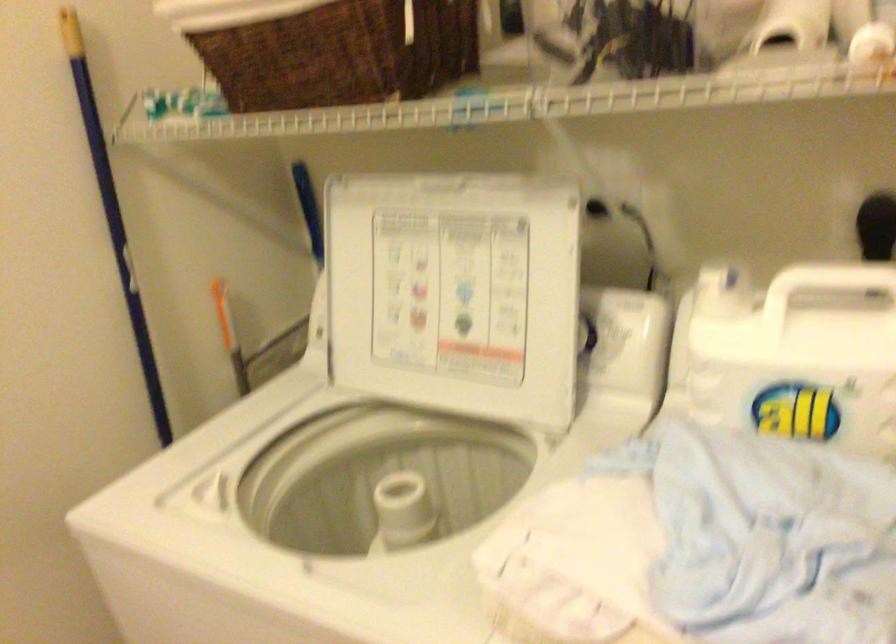
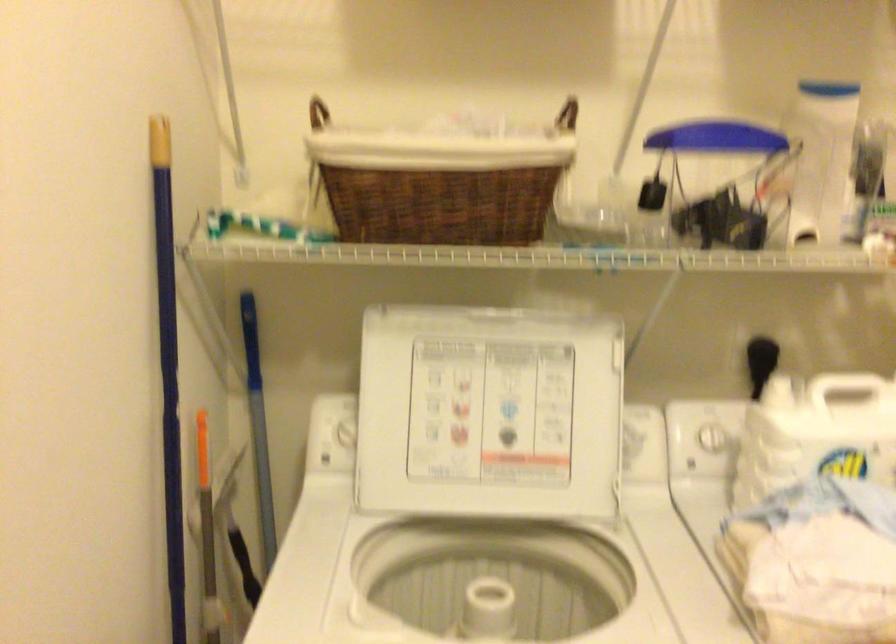
Find the pixel in the second image that matches [110,245] in the first image.

(168, 366)